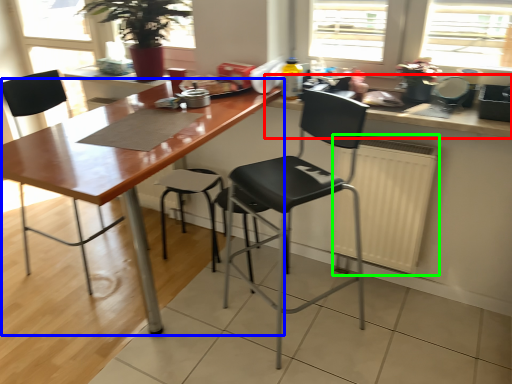
Question: Which object is positioned farthest from countertop (highlighted by a red box)? Select from table (highlighted by a blue box) and radiator (highlighted by a green box).

Choices:
 (A) table
 (B) radiator

Answer: (A)